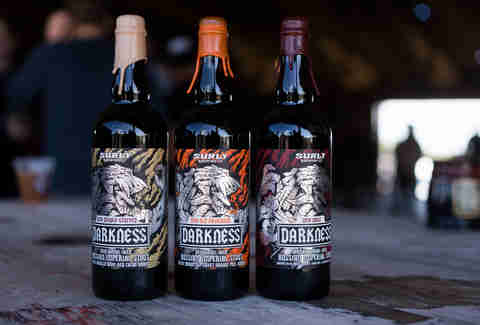
Where is `table`? The height and width of the screenshot is (325, 480). table is located at coordinates (388, 256).